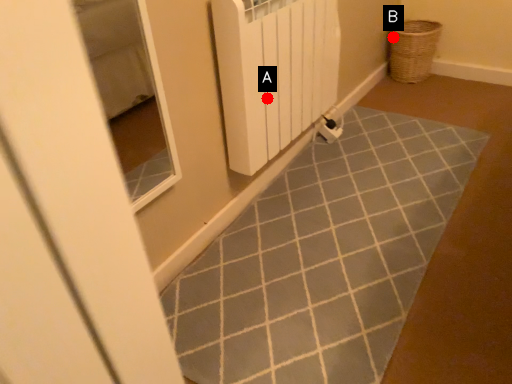
Question: Two points are circled on the image, labeled by A and B beside each circle. Among these points, which one is nearest to the camera?

Choices:
 (A) A is closer
 (B) B is closer

Answer: (A)